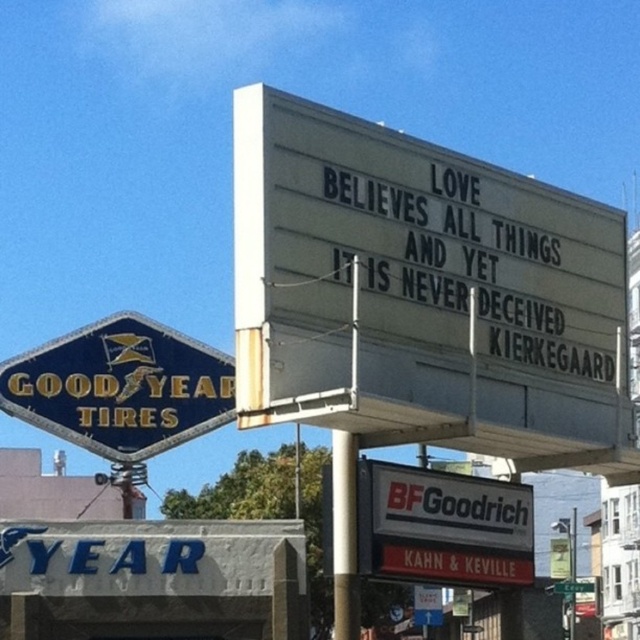
In order to click on white plastic signboard at upper center in this screenshot , I will do `click(417, 285)`.